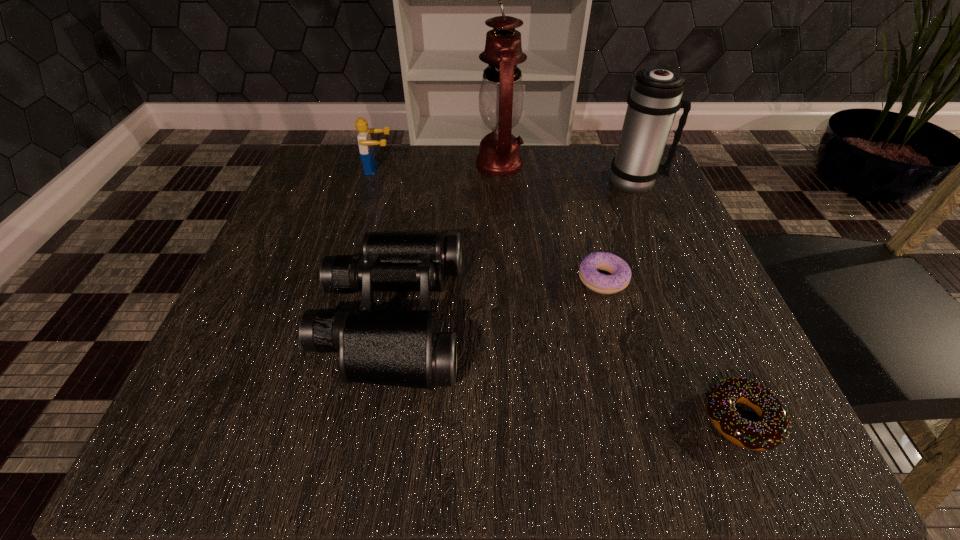
Identify the location of thermos bottle that is at the right edge. The width and height of the screenshot is (960, 540). (655, 97).

Where is `object that is at the far left corner`? This screenshot has width=960, height=540. object that is at the far left corner is located at coordinates (366, 149).

Image resolution: width=960 pixels, height=540 pixels. Identify the location of object that is positioned at the near left corner. (395, 348).

The width and height of the screenshot is (960, 540). I want to click on object located at the far right corner, so pos(655,97).

Image resolution: width=960 pixels, height=540 pixels. Identify the location of object situated at the near right corner. (773, 428).

Where is `vacant space at the far edge`? vacant space at the far edge is located at coordinates (437, 180).

Find the location of a particular element. The height and width of the screenshot is (540, 960). vacant region at the near edge of the desktop is located at coordinates (577, 424).

Where is `vacant area at the left edge`? The height and width of the screenshot is (540, 960). vacant area at the left edge is located at coordinates (269, 338).

Where is `vacant space at the right edge of the desktop`? vacant space at the right edge of the desktop is located at coordinates (681, 341).

Where is `free region at the far left corner of the desktop`? free region at the far left corner of the desktop is located at coordinates (316, 194).